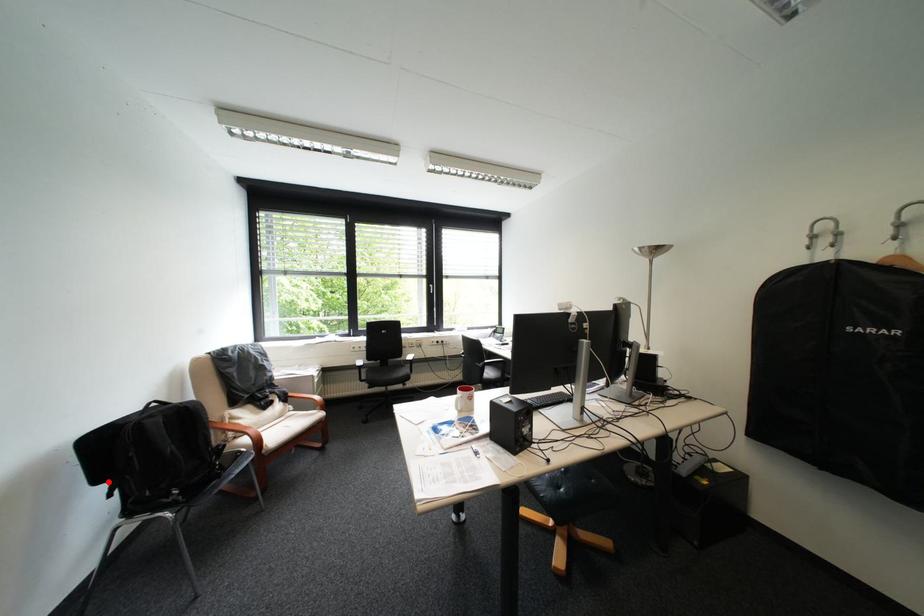
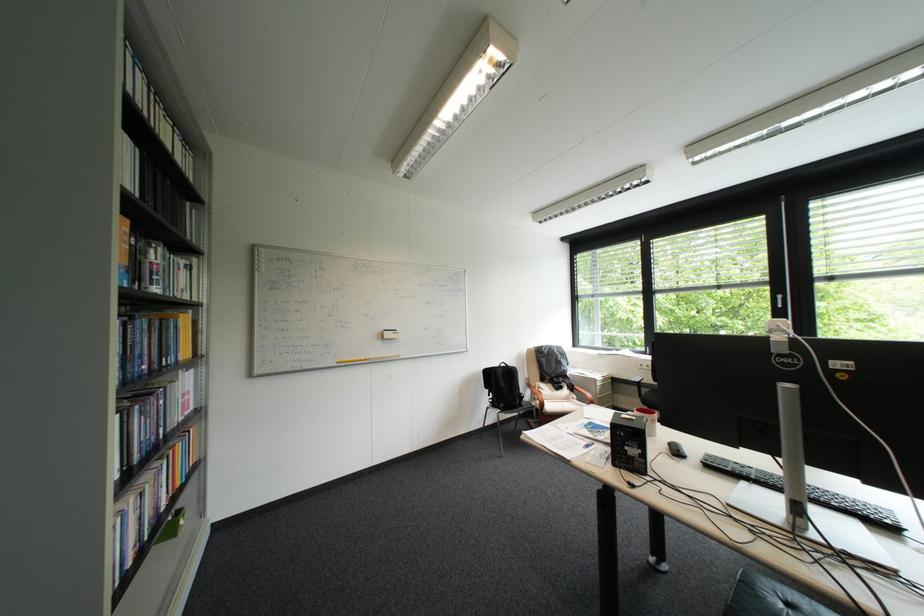
The point at the highlighted location is marked in the first image. Where is the corresponding point in the second image?

(497, 387)